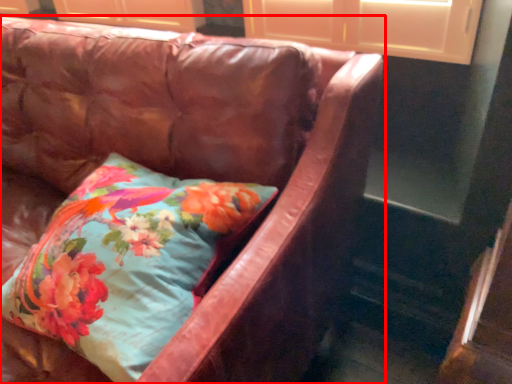
Question: From the image, what is the correct spatial relationship of studio couch (annotated by the red box) in relation to pillow?

Choices:
 (A) right
 (B) left

Answer: (B)